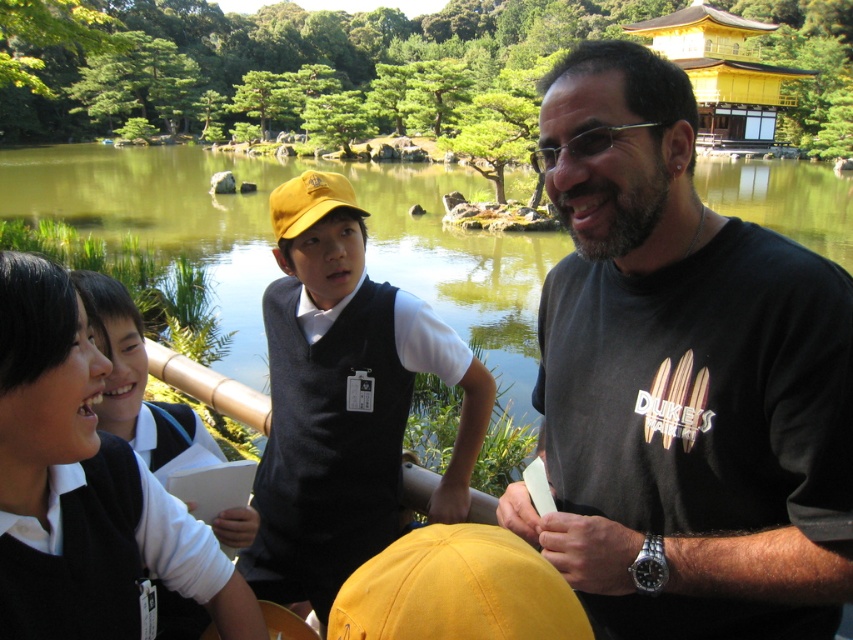
You are standing at the point marked by the coordinate point at (633, 412). You want to throw a stone to reach the two people who are 2.43 meters apart. Can you hit both with a single throw?

The two people are 2.43 meters apart. Since the distance between them is greater than the typical range a single stone can cover accurately, it would be challenging to hit both with one throw.